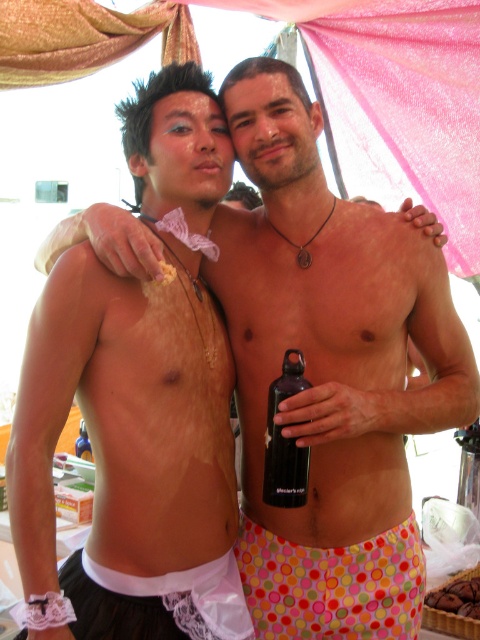
Is point (308, 636) positioned after point (248, 612)?

Yes.

Is polka dot fabric shorts at lower center positioned behind white lace garter at lower left?

Yes.

Locate an element on the screen. The image size is (480, 640). polka dot fabric shorts at lower center is located at coordinates (333, 584).

The image size is (480, 640). Identify the location of polka dot fabric shorts at lower center. (333, 584).

Who is higher up, polka dot fabric shorts at lower center or black matte water bottle at center?

black matte water bottle at center

Which of these two, polka dot fabric shorts at lower center or black matte water bottle at center, stands shorter?

polka dot fabric shorts at lower center

Is point (277, 628) less distant than point (292, 438)?

That is False.

You are a GUI agent. You are given a task and a screenshot of the screen. Output one action in this format:
    pyautogui.click(x=<x>, y=<y>)
    Task: Click on the polka dot fabric shorts at lower center
    This screenshot has height=640, width=480.
    Given the screenshot: What is the action you would take?
    pyautogui.click(x=333, y=584)

Does white lace garter at lower left have a greater width compared to black matte water bottle at center?

Indeed, white lace garter at lower left has a greater width compared to black matte water bottle at center.

Who is taller, white lace garter at lower left or black matte water bottle at center?

black matte water bottle at center

Which is in front, point (194, 584) or point (287, 442)?

Point (287, 442) is in front.

Where is `white lace garter at lower left`? This screenshot has width=480, height=640. white lace garter at lower left is located at coordinates (156, 602).